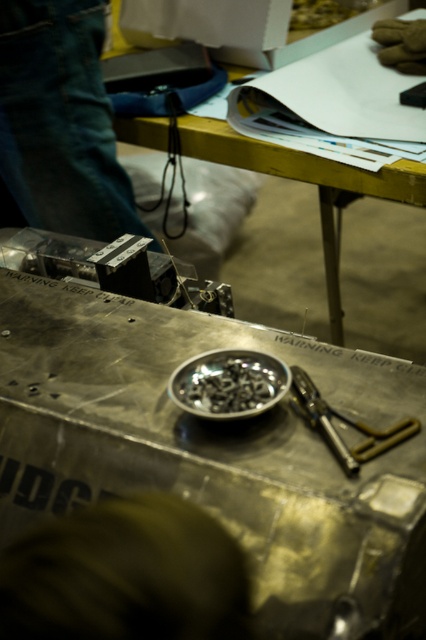
Question: Can you confirm if metallic silver table at center is positioned above jeans at upper left?

Choices:
 (A) yes
 (B) no

Answer: (B)

Question: Which object appears closest to the camera in this image?

Choices:
 (A) jeans at upper left
 (B) metallic silver pliers at center
 (C) brown fuzzy hair at lower center

Answer: (C)

Question: Which of these objects is positioned closest to the brown fuzzy hair at lower center?

Choices:
 (A) metallic yellow table at upper center
 (B) metallic silver table at center
 (C) jeans at upper left

Answer: (B)

Question: Is metallic silver table at center above metallic silver screws at center?

Choices:
 (A) yes
 (B) no

Answer: (A)

Question: Where is metallic silver table at center located in relation to metallic silver pliers at center in the image?

Choices:
 (A) below
 (B) above

Answer: (B)

Question: Which object appears closest to the camera in this image?

Choices:
 (A) metallic yellow table at upper center
 (B) metallic silver pliers at center
 (C) metallic silver table at center
 (D) metallic silver screws at center

Answer: (C)